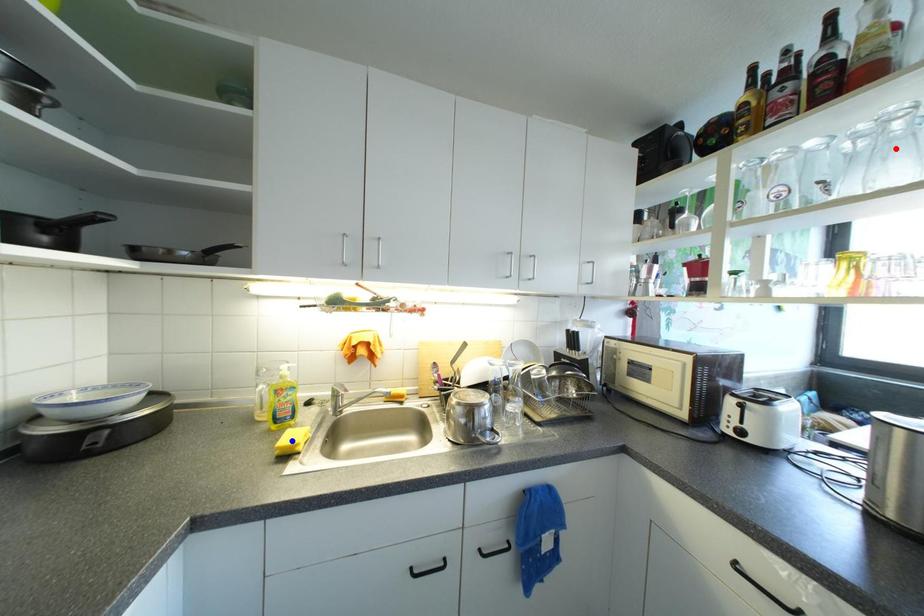
Question: Two points are marked on the image. Which point is closer to the camera?

Choices:
 (A) Blue point is closer.
 (B) Red point is closer.

Answer: (B)